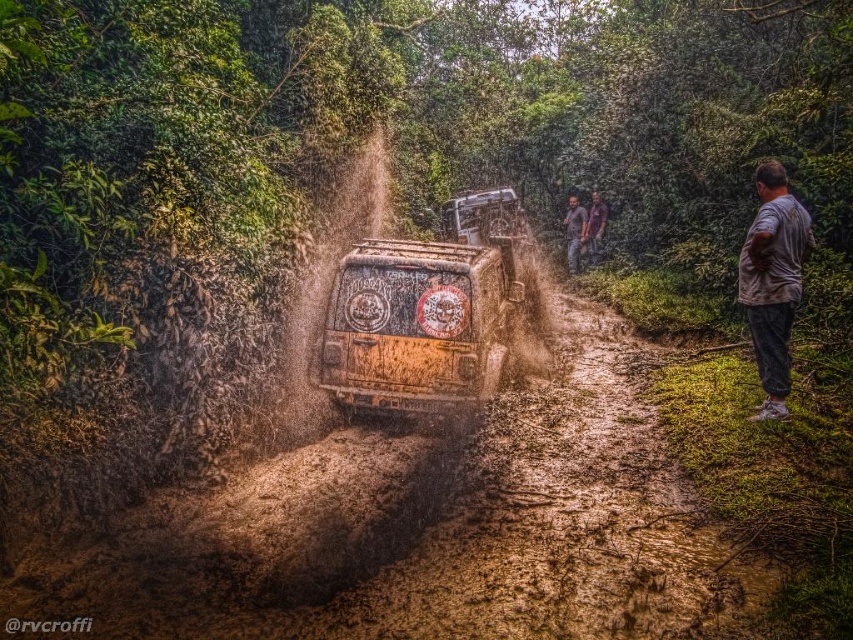
Does muddy terrain at center appear under rusty metallic truck at center?

Correct, muddy terrain at center is located below rusty metallic truck at center.

Is point (280, 560) less distant than point (492, 317)?

Yes.

The image size is (853, 640). In order to click on muddy terrain at center in this screenshot , I will do coord(427,531).

Is gray cotton shirt at right smaller than brown textured shirt at upper center?

Correct, gray cotton shirt at right occupies less space than brown textured shirt at upper center.

Who is positioned more to the right, gray cotton shirt at right or brown textured shirt at upper center?

brown textured shirt at upper center is more to the right.

Who is more forward, (775, 332) or (584, 218)?

Point (775, 332)

At what (x,y) coordinates should I click in order to perform the action: click on gray cotton shirt at right. Please return your answer as a coordinate pair (x, y). This screenshot has width=853, height=640. Looking at the image, I should click on (772, 282).

Does rusty metallic truck at center lie in front of gray cotton shirt at right?

That is False.

Which is below, rusty metallic truck at center or gray cotton shirt at right?

gray cotton shirt at right

Where is `rusty metallic truck at center`? rusty metallic truck at center is located at coordinates (433, 312).